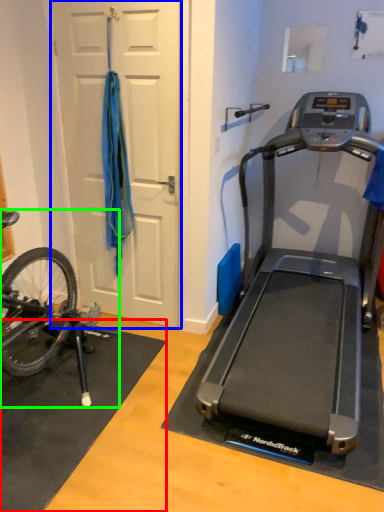
Question: Which object is the farthest from doormat (highlighted by a red box)? Choose among these: door (highlighted by a blue box) or mountain bike (highlighted by a green box).

Choices:
 (A) door
 (B) mountain bike

Answer: (A)